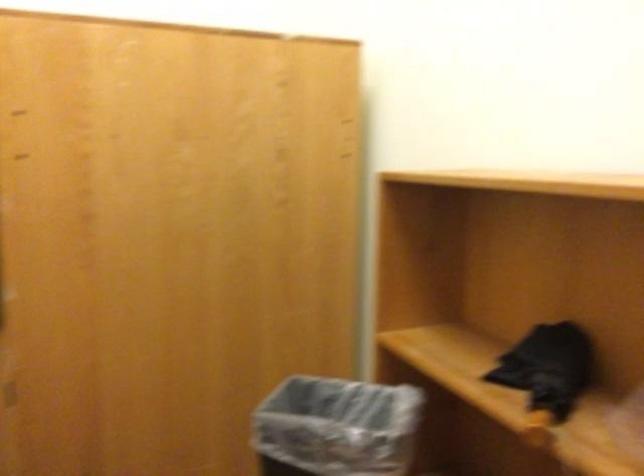
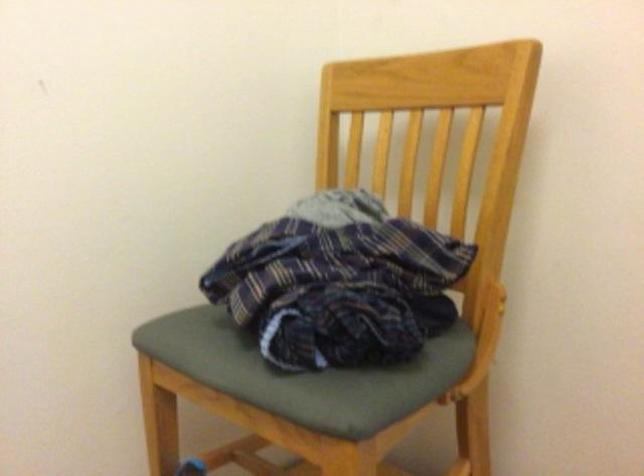
Question: The camera is either moving clockwise (left) or counter-clockwise (right) around the object. The first image is from the beginning of the video and the second image is from the end. Is the camera moving left or right when shooting the video?

Choices:
 (A) Left
 (B) Right

Answer: (A)